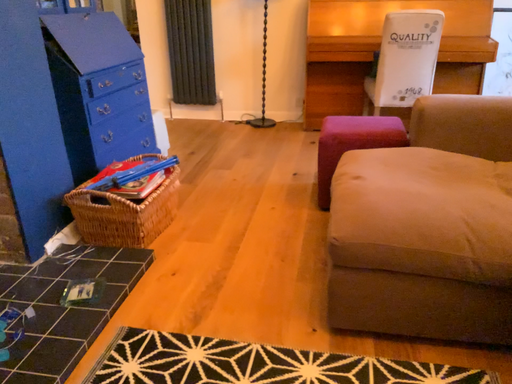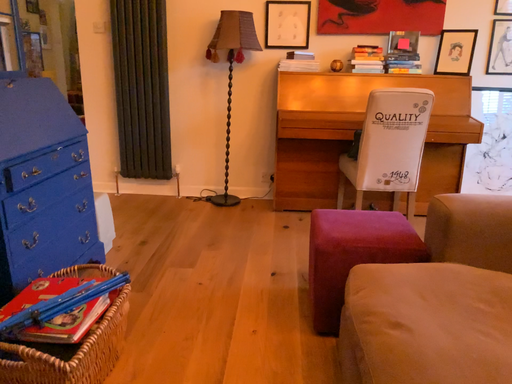
Question: How did the camera likely rotate when shooting the video?

Choices:
 (A) rotated upward
 (B) rotated downward

Answer: (A)